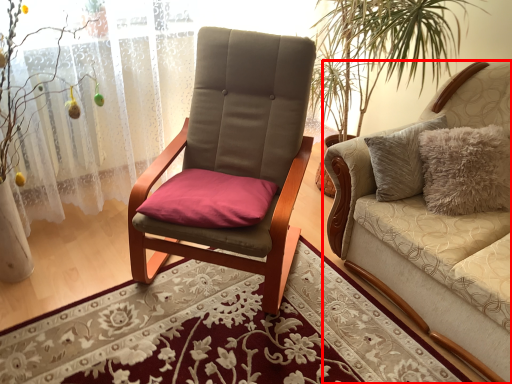
Question: From the image's perspective, what is the correct spatial relationship of studio couch (annotated by the red box) in relation to curtain?

Choices:
 (A) below
 (B) above

Answer: (A)